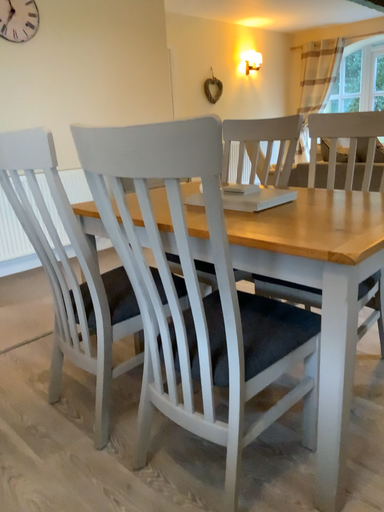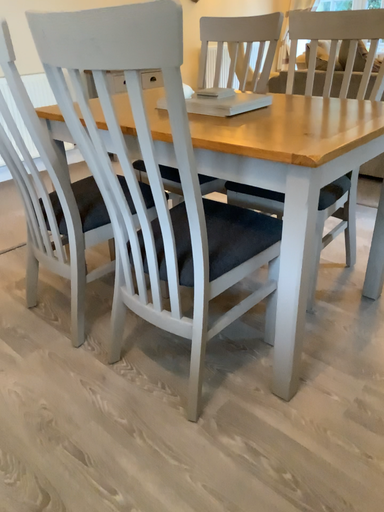
Question: How did the camera likely rotate when shooting the video?

Choices:
 (A) rotated downward
 (B) rotated upward

Answer: (A)